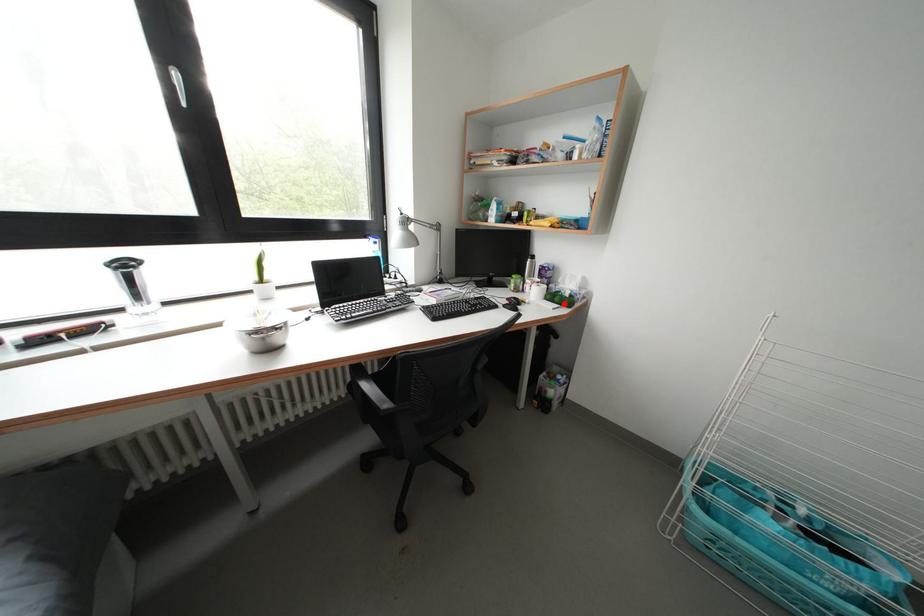
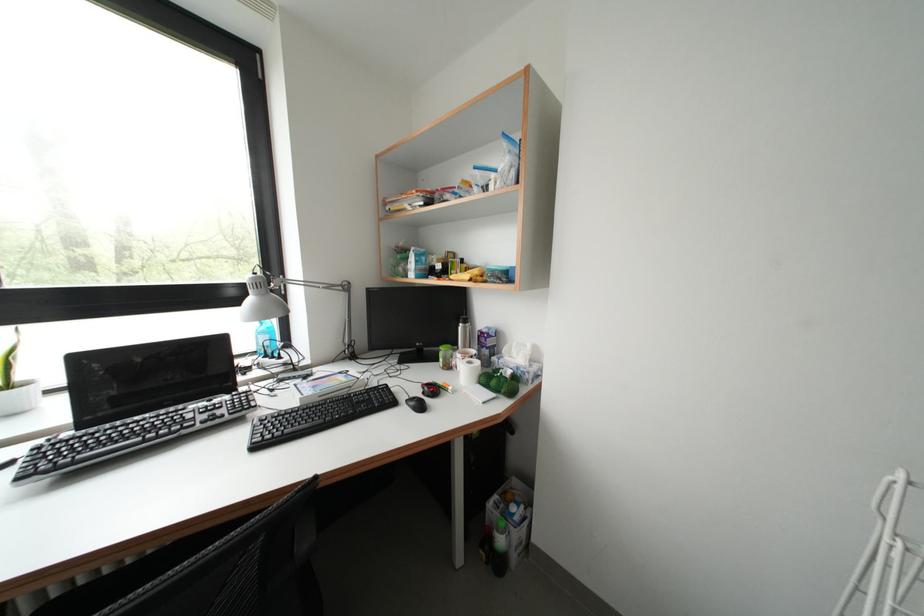
Where in the second image is the point corresponding to the highlighted location from the first image?

(500, 387)